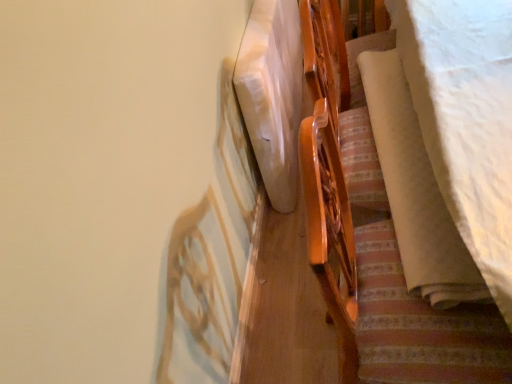
Question: Looking at their shapes, would you say white matte mattress at center is wider or thinner than white soft fabric at right?

Choices:
 (A) thin
 (B) wide

Answer: (A)

Question: Looking at the image, does white matte mattress at center seem bigger or smaller compared to white soft fabric at right?

Choices:
 (A) small
 (B) big

Answer: (B)

Question: Estimate the real-world distances between objects in this image. Which object is farther from the white soft fabric at right?

Choices:
 (A) white matte mattress at center
 (B) wooden bed frame at upper right

Answer: (A)

Question: Considering the real-world distances, which object is closest to the white matte mattress at center?

Choices:
 (A) white soft fabric at right
 (B) wooden bed frame at upper right

Answer: (B)